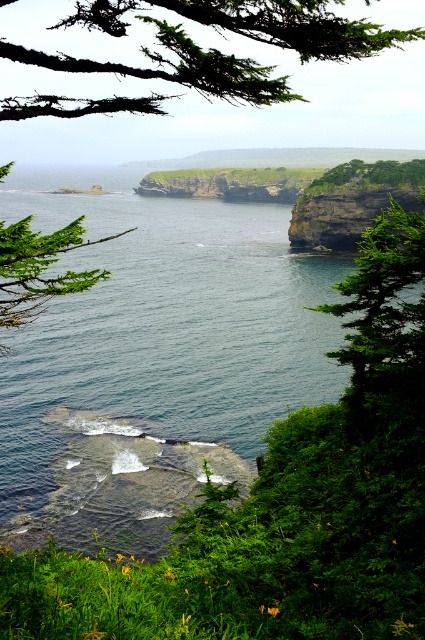
You are standing on the rocky shoreline and see the green leafy tree at left and the green leafy tree at upper center. Which tree is positioned more to the left side of the scene?

The green leafy tree at left is positioned more to the left side of the scene compared to the green leafy tree at upper center.

You are standing on the cliff edge and want to place a 10 meters long safety rope between the green mossy branch at upper left and another point. Is the distance sufficient?

The green mossy branch at upper left is 7.81 meters away from viewer, so the 10 meters long safety rope is longer than the distance. Therefore, the distance is sufficient to place the rope between the branch and another point.

You are standing at the center of the image looking towards the shoreline. Which direction should you walk to reach the green leafy tree at right?

The green leafy tree at right is located to the right side of the image, so you should walk towards the right to reach it.